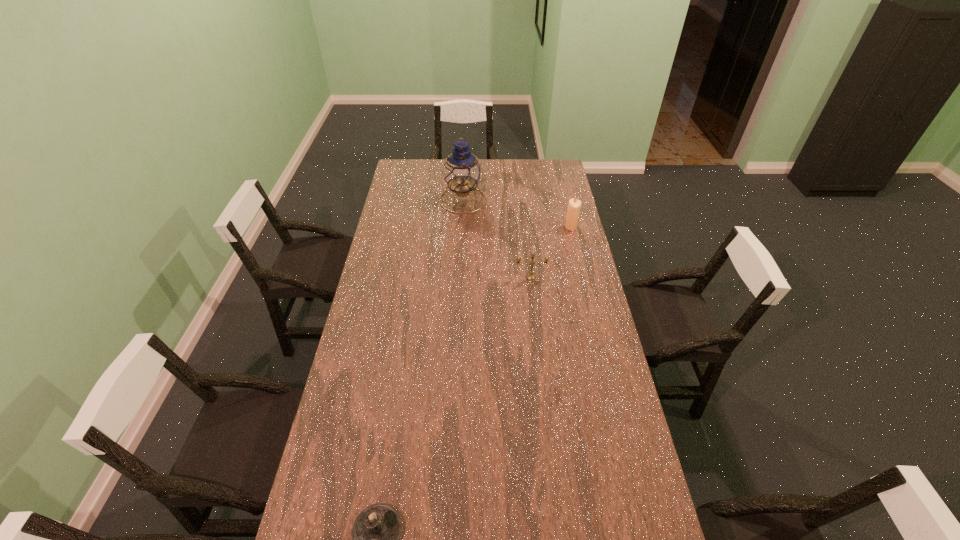
Find the location of a particular element. The image size is (960, 540). lantern is located at coordinates (462, 172).

Image resolution: width=960 pixels, height=540 pixels. I want to click on the tallest object, so click(x=462, y=172).

Where is `the rightmost object`? the rightmost object is located at coordinates (574, 205).

Identify the location of the rightmost candle. The width and height of the screenshot is (960, 540). [x=574, y=205].

You are a GUI agent. You are given a task and a screenshot of the screen. Output one action in this format:
    pyautogui.click(x=<x>, y=<y>)
    Task: Click on the second farthest candle
    
    Given the screenshot: What is the action you would take?
    pyautogui.click(x=530, y=276)

At what (x,y) coordinates should I click in order to perform the action: click on the third object from left to right. Please return your answer as a coordinate pair (x, y). This screenshot has height=540, width=960. Looking at the image, I should click on (530, 276).

Where is `vacant point located on the front-facing side of the tallest object`? This screenshot has height=540, width=960. vacant point located on the front-facing side of the tallest object is located at coordinates (461, 249).

This screenshot has height=540, width=960. I want to click on free space located 0.120m on the front of the farthest candle, so click(576, 248).

Find the location of a particular element. vacant space located on the right of the second nearest object is located at coordinates (576, 277).

Locate an element on the screen. The height and width of the screenshot is (540, 960). object at the right edge is located at coordinates (574, 205).